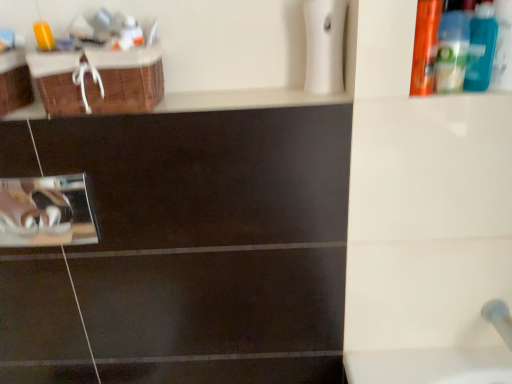
Question: Looking at the image, does brown woven basket at upper left seem bigger or smaller compared to translucent plastic mouthwash at upper left, which ranks as the first mouthwash in left-to-right order?

Choices:
 (A) small
 (B) big

Answer: (B)

Question: Is point (159, 89) positioned closer to the camera than point (129, 23)?

Choices:
 (A) farther
 (B) closer

Answer: (A)

Question: Which object is the closest to the brown woven basket at upper left?

Choices:
 (A) white glossy pipe at lower right
 (B) translucent plastic mouthwash at upper left, which ranks as the first mouthwash in left-to-right order
 (C) blue plastic bottle at upper right, arranged as the first mouthwash when viewed from the right
 (D) blue plastic bottle at upper right, the third mouthwash in the left-to-right sequence
 (E) orange plastic bottle at upper right, which is the third mouthwash in right-to-left order

Answer: (B)

Question: Which object is positioned closest to the orange plastic bottle at upper right, the second mouthwash when ordered from left to right?

Choices:
 (A) white glossy pipe at lower right
 (B) translucent plastic mouthwash at upper left, which ranks as the first mouthwash in left-to-right order
 (C) blue plastic bottle at upper right, the third mouthwash in the left-to-right sequence
 (D) blue plastic bottle at upper right, the fourth mouthwash in the left-to-right sequence
 (E) brown woven basket at upper left

Answer: (C)